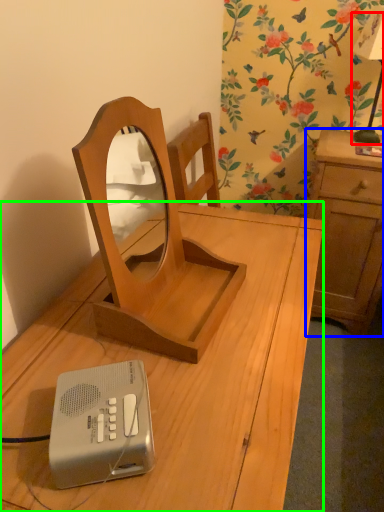
Question: Which object is the farthest from bedside lamp (highlighted by a red box)? Choose among these: cabinetry (highlighted by a blue box) or desk (highlighted by a green box).

Choices:
 (A) cabinetry
 (B) desk

Answer: (B)